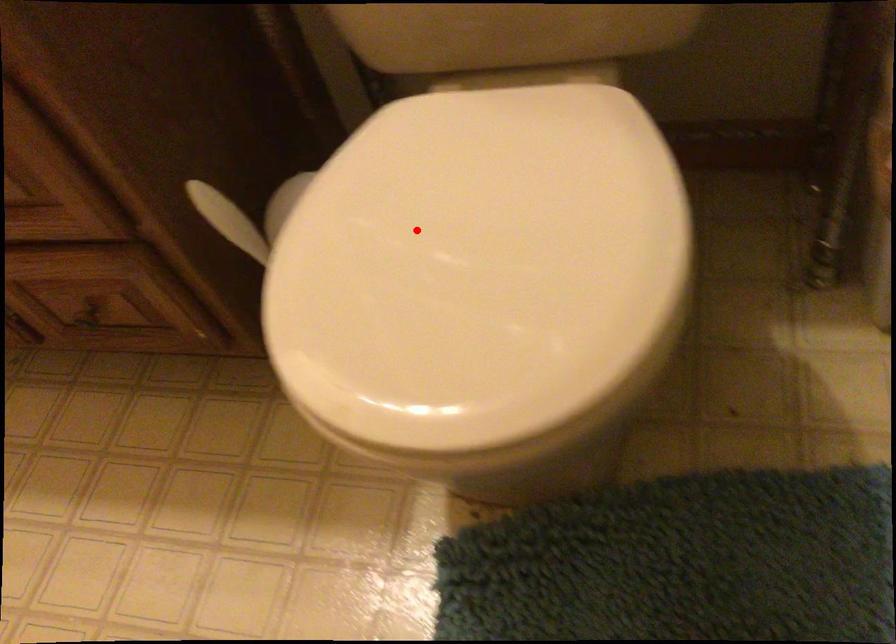
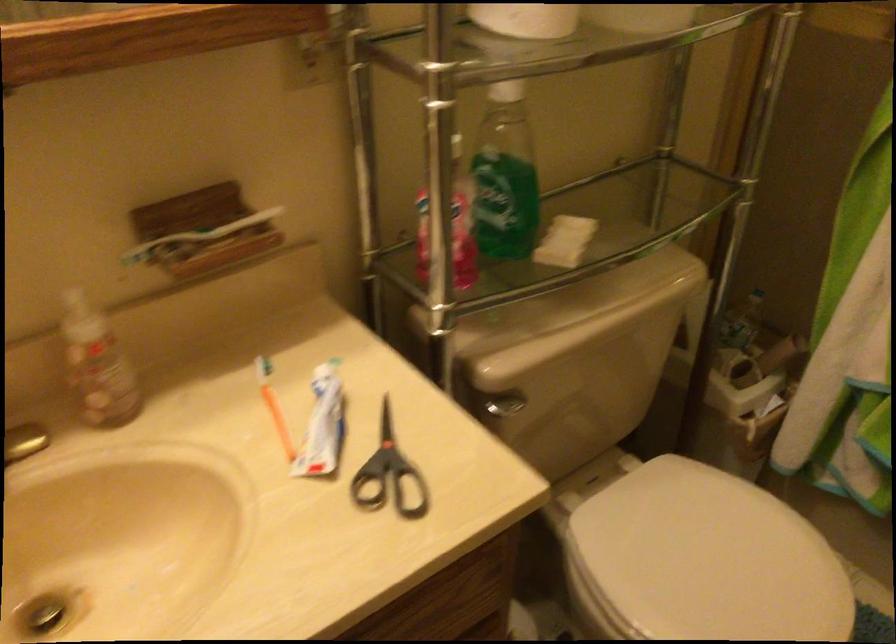
Find the pixel in the second image that matches the highlighted location in the first image.

(702, 560)